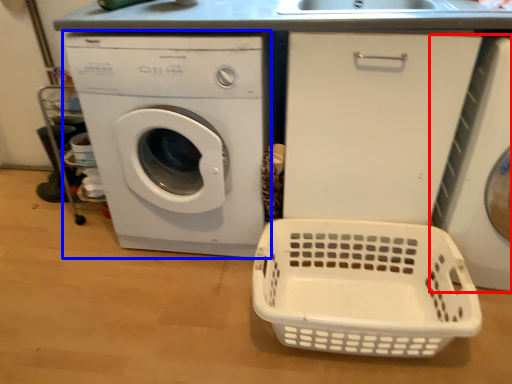
Question: Which object is closer to the camera taking this photo, washing machine (highlighted by a red box) or washing machine (highlighted by a blue box)?

Choices:
 (A) washing machine
 (B) washing machine

Answer: (A)